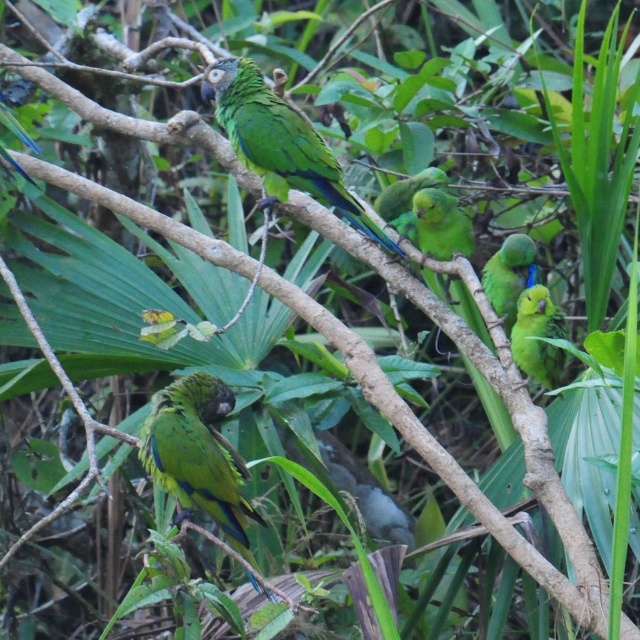
You are observing two parrots in a lush forest. You see a green matte parrot at lower left and a green matte parrot at right. Which parrot is positioned further to the left?

The green matte parrot at lower left is positioned further to the left than the green matte parrot at right.

You are a birder observing the parrots in the image. You notice two parrots, the green matte parrot at lower left and the green matte parrot at right. Which parrot is closer to you?

The green matte parrot at lower left is closer to you because it is in front of the green matte parrot at right.